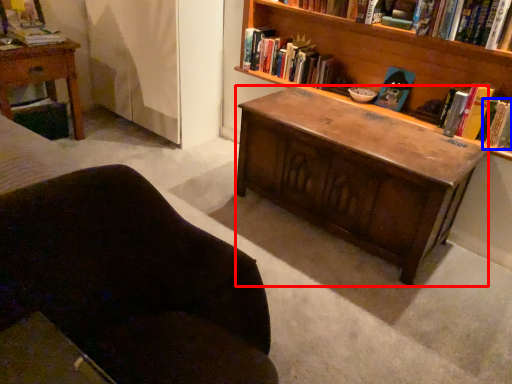
Question: Which object is closer to the camera taking this photo, desk (highlighted by a red box) or book (highlighted by a blue box)?

Choices:
 (A) desk
 (B) book

Answer: (A)